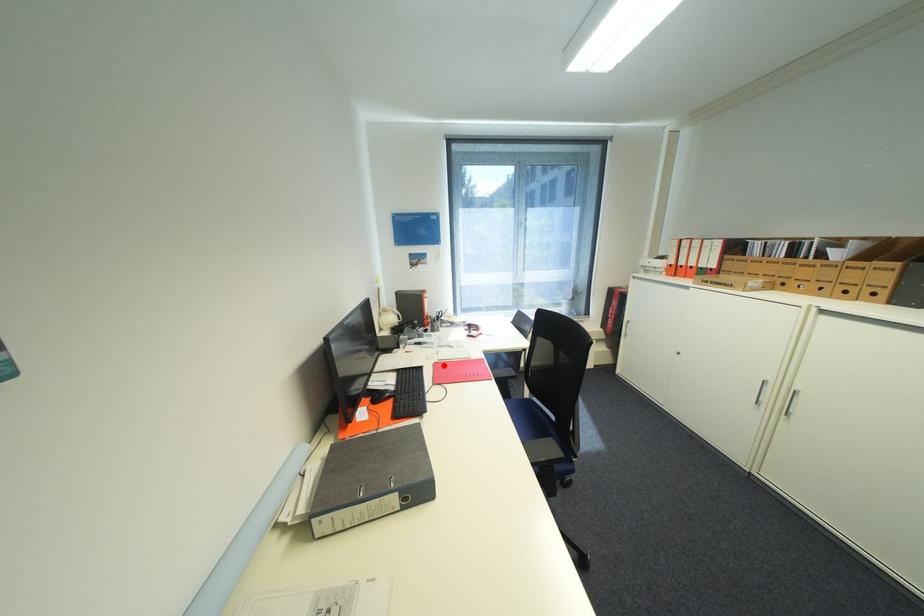
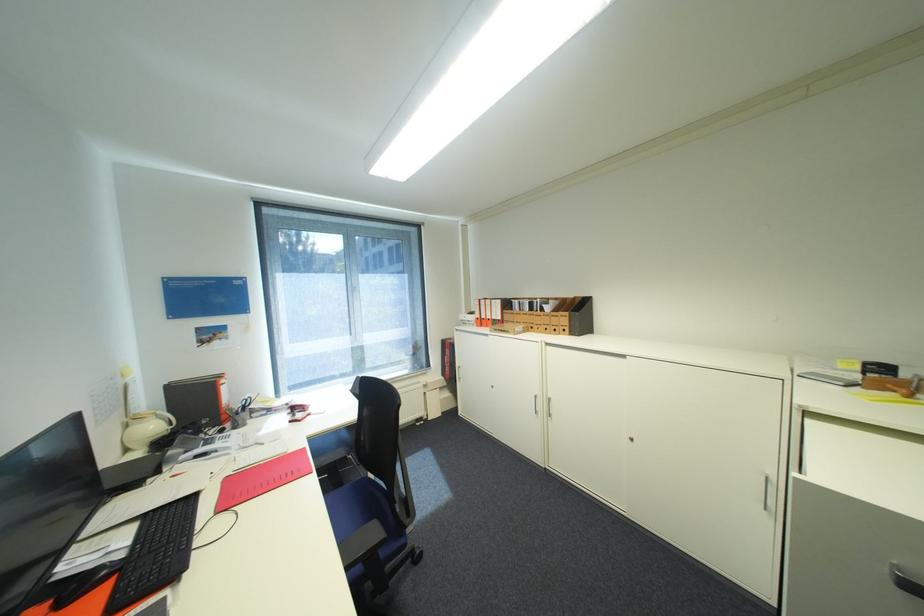
Question: I am providing you with two images of the same scene from different viewpoints. A red point is marked on the first image. Is the red point's position out of view in image 2?

Choices:
 (A) Yes
 (B) No

Answer: (B)